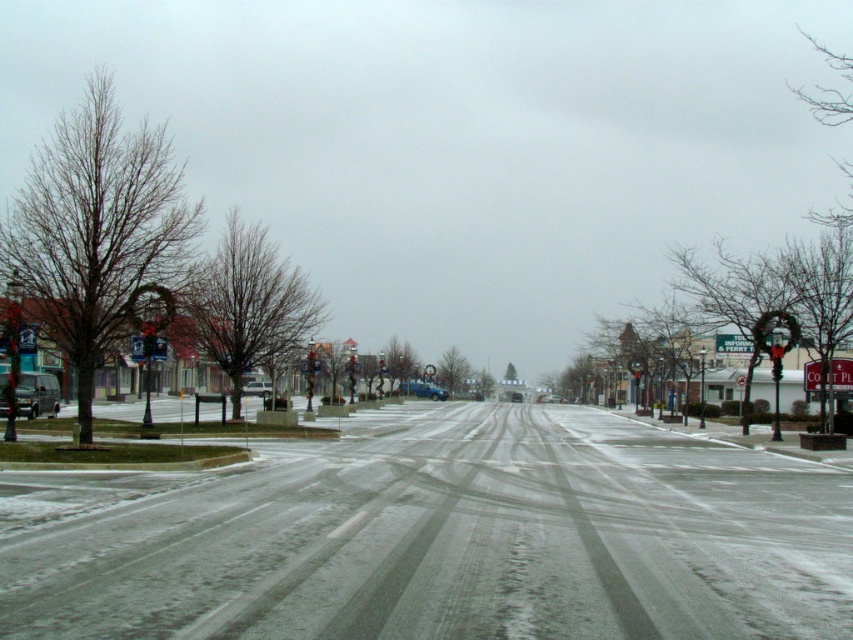
You are standing on the snow and want to place a snowman exactly at the center of the white powdery snow at center. Where should you place it?

The snowman should be placed at point (x=444, y=538) on the white powdery snow at center.

You are driving a car and see the image. There is a shiny black van at left and white powdery snow at center. Which object is closer to you as you drive forward?

The white powdery snow at center is closer to you because it is in front of the shiny black van at left, meaning the van is behind the snow in the scene.